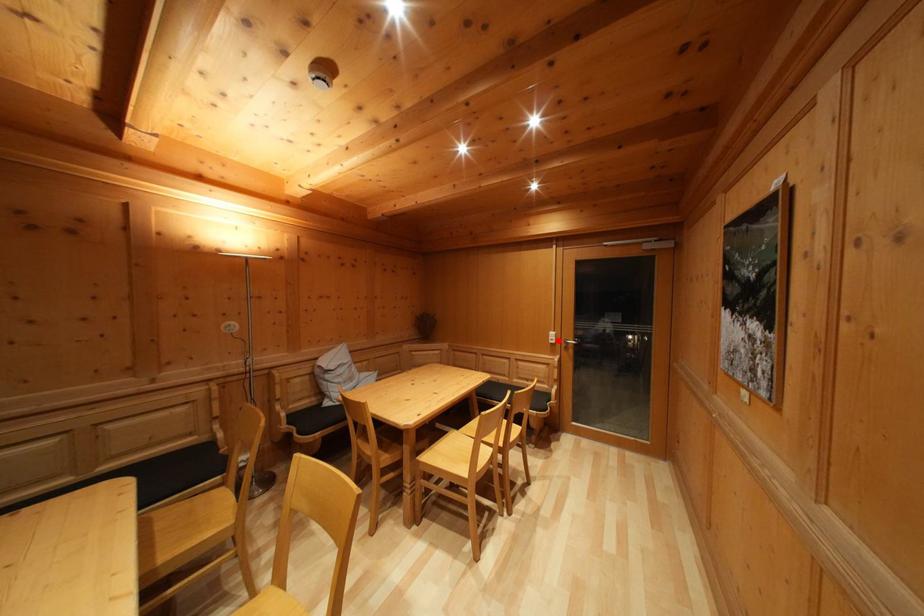
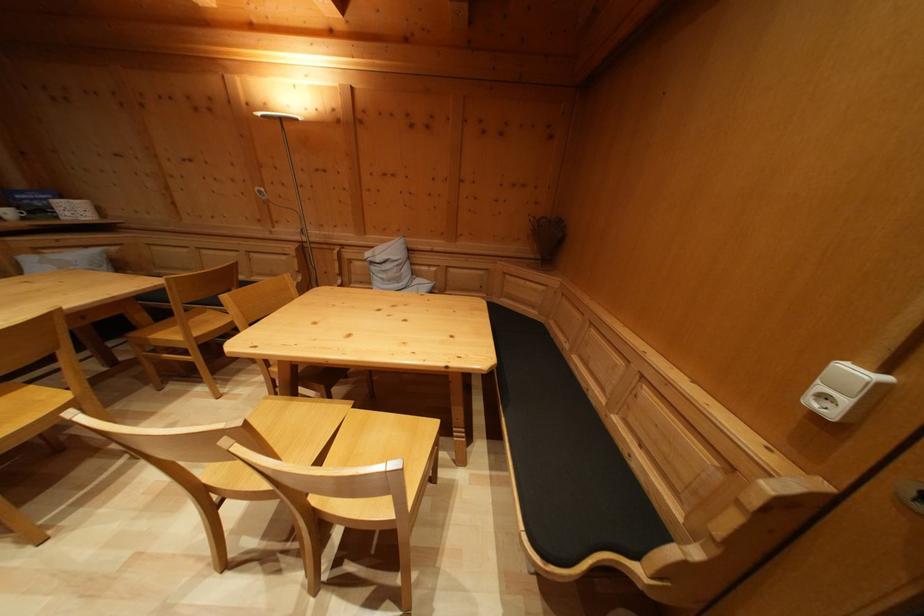
The point at the highlighted location is marked in the first image. Where is the corresponding point in the second image?

(859, 379)